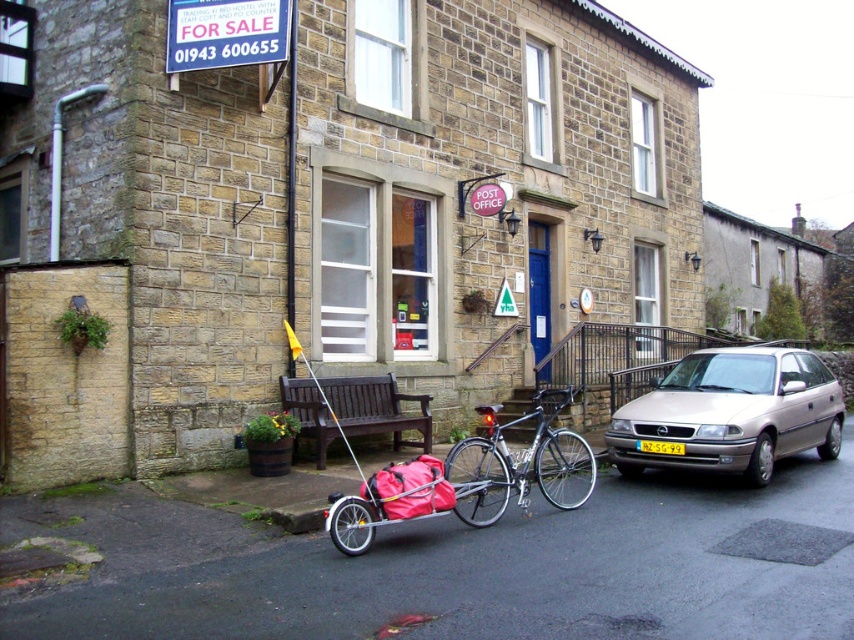
Which is above, silver metallic hatchback at right or yellow plastic license plate at center?

silver metallic hatchback at right is higher up.

Which is behind, point (700, 436) or point (650, 451)?

The point (650, 451) is behind.

What are the coordinates of `silver metallic hatchback at right` in the screenshot? It's located at (732, 412).

Who is shorter, shiny metallic bicycle at center or yellow plastic license plate at center?

Standing shorter between the two is yellow plastic license plate at center.

Does shiny metallic bicycle at center come in front of yellow plastic license plate at center?

That is True.

Identify the location of shiny metallic bicycle at center. (519, 464).

Is point (468, 448) farther from camera compared to point (343, 394)?

No, it is in front of (343, 394).

What do you see at coordinates (519, 464) in the screenshot? I see `shiny metallic bicycle at center` at bounding box center [519, 464].

Which is behind, point (595, 465) or point (348, 396)?

Point (348, 396)

Find the location of a particular element. shiny metallic bicycle at center is located at coordinates (519, 464).